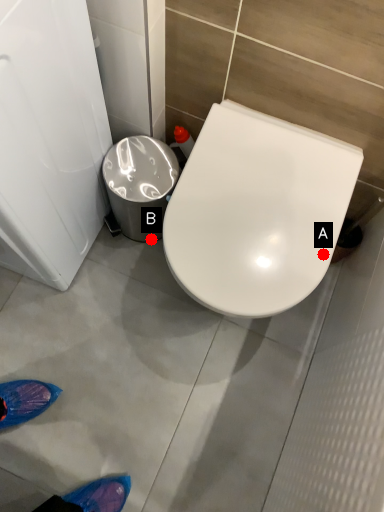
Question: Two points are circled on the image, labeled by A and B beside each circle. Which point is closer to the camera taking this photo?

Choices:
 (A) A is closer
 (B) B is closer

Answer: (A)